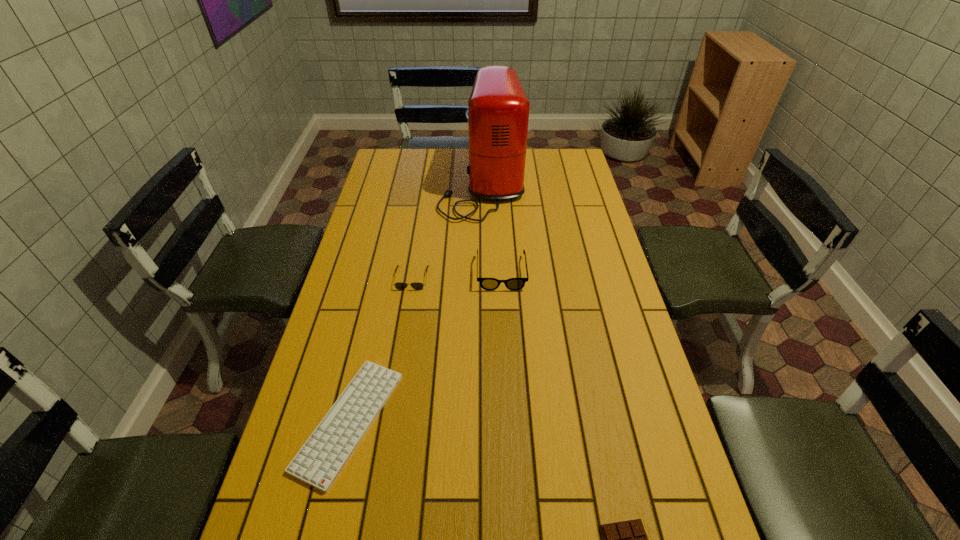
Locate an element on the screen. This screenshot has width=960, height=540. vacant area situated on the back of the second nearest object is located at coordinates (384, 268).

You are a GUI agent. You are given a task and a screenshot of the screen. Output one action in this format:
    pyautogui.click(x=<x>, y=<y>)
    Task: Click on the object located at the far edge
    Image resolution: width=960 pixels, height=540 pixels.
    Given the screenshot: What is the action you would take?
    pyautogui.click(x=498, y=109)

You are a GUI agent. You are given a task and a screenshot of the screen. Output one action in this format:
    pyautogui.click(x=<x>, y=<y>)
    Task: Click on the object situated at the left edge
    
    Given the screenshot: What is the action you would take?
    pyautogui.click(x=319, y=462)

In the image, there is a desktop. Identify the location of vacant space at the far edge. 430,174.

The image size is (960, 540). In order to click on free space at the left edge of the desktop in this screenshot , I will do `click(390, 180)`.

At what (x,y) coordinates should I click in order to perform the action: click on blank space at the right edge of the desktop. Please return your answer as a coordinate pair (x, y). This screenshot has height=540, width=960. Looking at the image, I should click on (617, 362).

Image resolution: width=960 pixels, height=540 pixels. What are the coordinates of `free spot at the far left corner of the desktop` in the screenshot? It's located at (397, 167).

Locate an element on the screen. The height and width of the screenshot is (540, 960). free point between the computer keyboard and the kitchen mixer is located at coordinates [x=416, y=303].

Find the location of `unoccupied position between the tallest object and the sunglasses`. unoccupied position between the tallest object and the sunglasses is located at coordinates (447, 231).

Image resolution: width=960 pixels, height=540 pixels. What are the coordinates of `free point between the spectacles and the farthest object` in the screenshot? It's located at (492, 228).